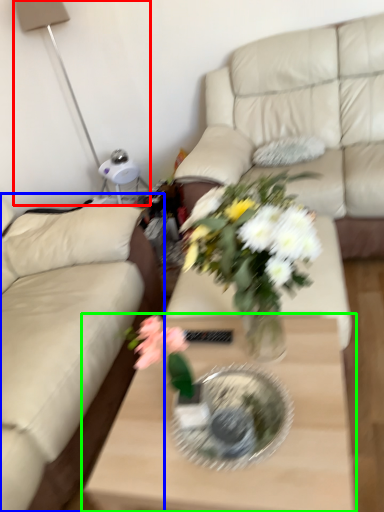
Question: Which object is positioned closest to table lamp (highlighted by a red box)? Select from studio couch (highlighted by a blue box) and coffee table (highlighted by a green box).

Choices:
 (A) studio couch
 (B) coffee table

Answer: (A)